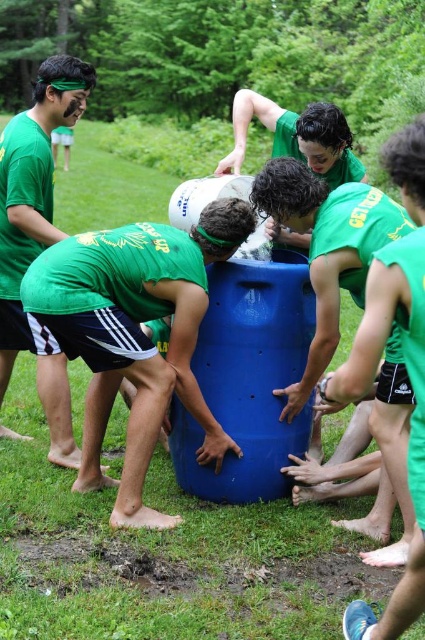
You are standing at the center of the grassy area and want to reach the matte blue barrel at center. According to the coordinates provided, in which direction should you move from your current position to reach it?

The matte blue barrel at center is located at coordinates point (x=136, y=333), so you should move towards the center of the grassy area to reach it.